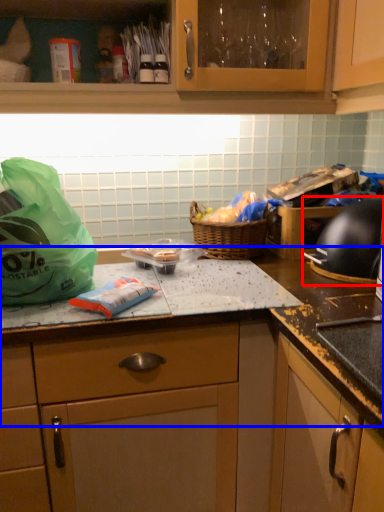
Question: Which object is closer to the camera taking this photo, gas stove (highlighted by a red box) or countertop (highlighted by a blue box)?

Choices:
 (A) gas stove
 (B) countertop

Answer: (B)